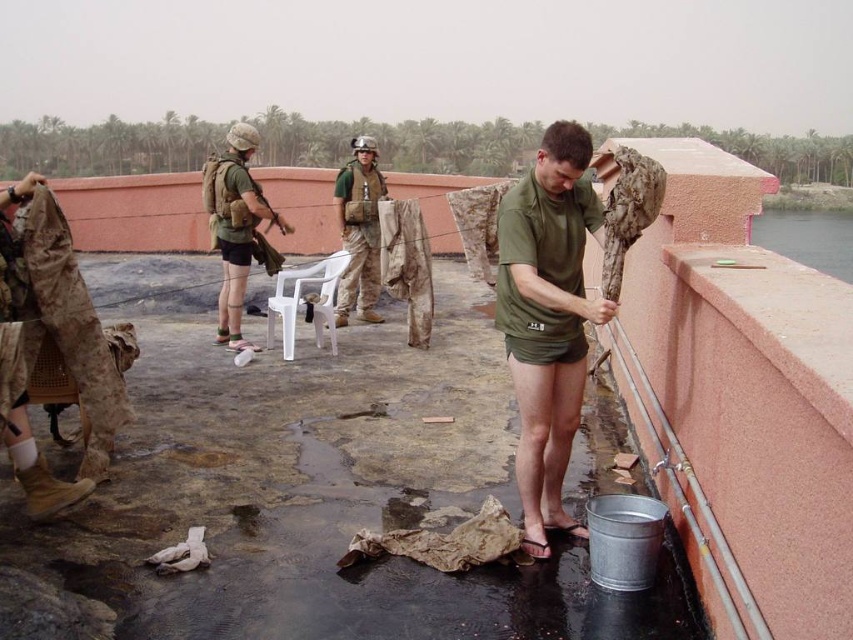
Question: Does green matte t-shirt at center appear on the right side of camouflage fabric vest at upper center?

Choices:
 (A) yes
 (B) no

Answer: (A)

Question: Based on their relative distances, which object is farther from the green matte shirt at center?

Choices:
 (A) clear water at edge right
 (B) camouflage fabric vest at center
 (C) camouflage fabric uniform at center

Answer: (A)

Question: From the image, what is the correct spatial relationship of clear water at edge right in relation to camouflage fabric vest at upper center?

Choices:
 (A) above
 (B) below

Answer: (A)

Question: Which is nearer to the camouflage fabric uniform at center?

Choices:
 (A) clear water at edge right
 (B) camouflage fabric vest at center
 (C) camouflage fabric vest at upper center

Answer: (B)

Question: Which of these objects is positioned farthest from the camouflage fabric uniform at center?

Choices:
 (A) camouflage fabric vest at upper center
 (B) green matte shirt at center
 (C) clear water at edge right
 (D) green matte t-shirt at center

Answer: (C)

Question: Is green matte t-shirt at center below camouflage fabric vest at upper center?

Choices:
 (A) no
 (B) yes

Answer: (B)